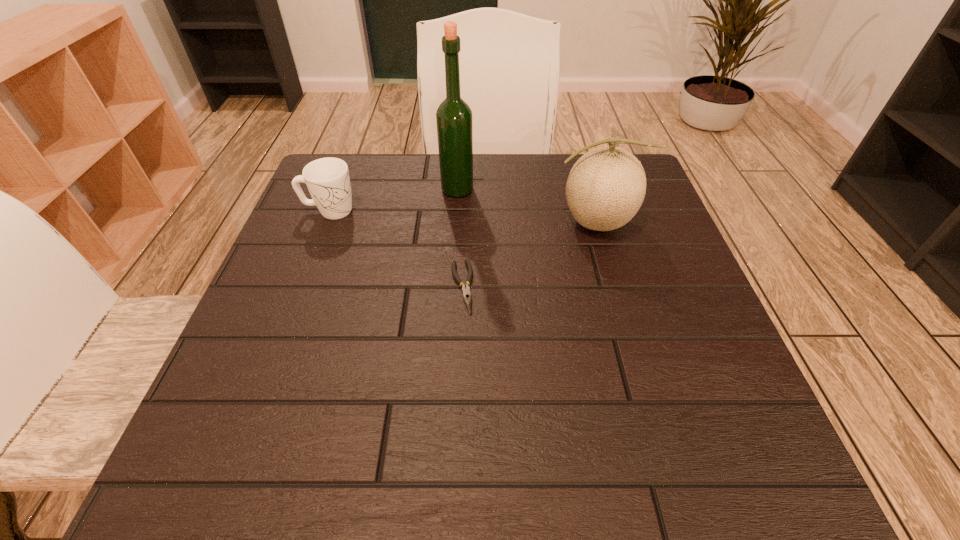
The image size is (960, 540). Identify the location of liquor. (454, 121).

At what (x,y) coordinates should I click in order to perform the action: click on the third shortest object. Please return your answer as a coordinate pair (x, y). Looking at the image, I should click on (606, 187).

In order to click on the rightmost object in this screenshot , I will do `click(606, 187)`.

The height and width of the screenshot is (540, 960). What are the coordinates of `the leftmost object` in the screenshot? It's located at (328, 181).

I want to click on the third tallest object, so click(x=328, y=181).

Identify the location of the shortest object. (x=467, y=297).

The height and width of the screenshot is (540, 960). I want to click on pliers, so click(x=467, y=297).

You are a GUI agent. You are given a task and a screenshot of the screen. Output one action in this format:
    pyautogui.click(x=<x>, y=<y>)
    Task: Click on the free space located 0.190m on the front of the tallest object
    The width and height of the screenshot is (960, 540).
    Given the screenshot: What is the action you would take?
    pyautogui.click(x=453, y=255)

This screenshot has height=540, width=960. In order to click on vacant space located on the front of the rightmost object in this screenshot , I will do `click(627, 338)`.

Find the location of a particular element. Image resolution: width=960 pixels, height=540 pixels. free region located 0.360m on the side of the mug with the handle is located at coordinates (517, 211).